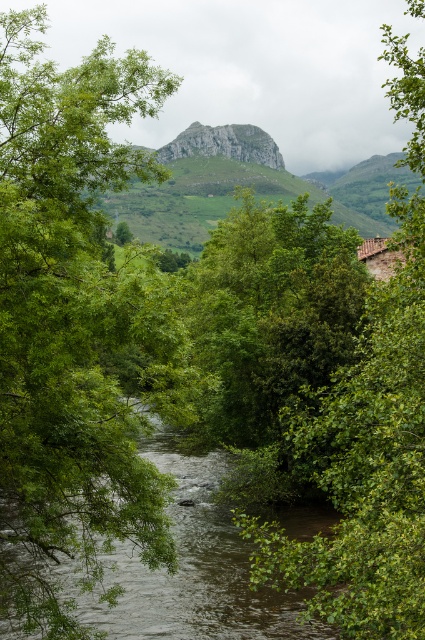
You are standing at the point with coordinates (365,464) in the scene. What object are you directly facing?

The point at coordinates (365,464) indicates a green leafy tree at center, so you are directly facing the green leafy tree at center.

Consider the image. You are standing at the origin point in the scene. Where is the green leafy stream at center located in terms of 2D coordinates?

The green leafy stream at center is located at the 2D coordinates of point (184, 570).